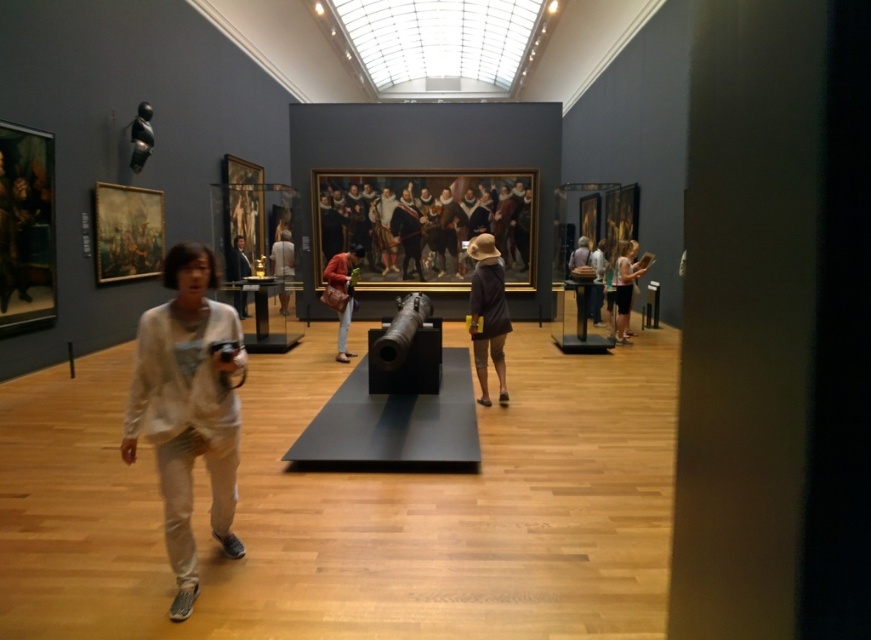
You are standing in the museum gallery and see the point marked at coordinates (282, 268). According to the image description, where exactly is this point located?

The point at (282, 268) is located on the white fabric dress at center.

You are a museum visitor who wants to take a photo of both the white fabric dress at center and the matte black jacket at center in the same frame. Based on their distance, can you fit both items into your smartphone camera viewfinder without moving your position?

The white fabric dress at center and matte black jacket at center are 73.76 centimeters apart from each other. Since the distance between them is relatively small, it is likely possible to fit both items into your smartphone camera viewfinder without moving your position.

You are a security guard in the museum gallery. You need to check the size of the white cotton shirt at lower left and the matte black jacket at center to ensure they fit in a storage box. Which one is smaller?

The white cotton shirt at lower left is smaller than the matte black jacket at center, so it will fit better in the storage box.